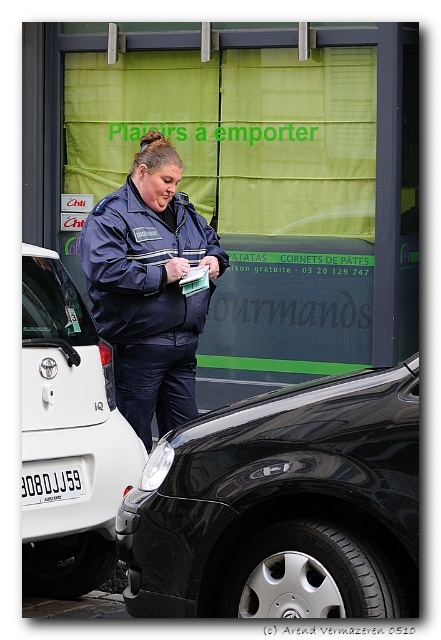
Measure the distance between shiny black car at lower right and camera.

3.07 meters

Can you confirm if shiny black car at lower right is thinner than matte blue uniform at center?

No, shiny black car at lower right is not thinner than matte blue uniform at center.

Is point (215, 449) farther from camera compared to point (148, 365)?

No, it is in front of (148, 365).

Locate an element on the screen. shiny black car at lower right is located at coordinates (283, 506).

Is white matte car at left positioned at the back of white plastic license plate at center?

No, it is not.

Who is shorter, white matte car at left or white plastic license plate at center?

white plastic license plate at center

This screenshot has width=441, height=640. Describe the element at coordinates (67, 436) in the screenshot. I see `white matte car at left` at that location.

In order to click on white matte car at left in this screenshot , I will do `click(67, 436)`.

Which is behind, point (418, 360) or point (48, 509)?

The point (48, 509) is more distant.

Who is shorter, shiny black car at lower right or white matte car at left?

With less height is shiny black car at lower right.

Identify the location of shiny black car at lower right. The height and width of the screenshot is (640, 441). (283, 506).

Identify the location of shiny black car at lower right. (283, 506).